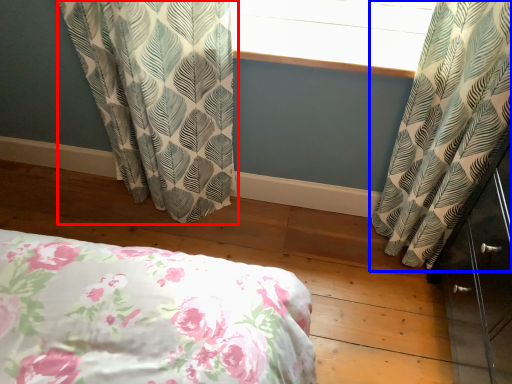
Question: Which of the following is the farthest to the observer, curtain (highlighted by a red box) or curtain (highlighted by a blue box)?

Choices:
 (A) curtain
 (B) curtain

Answer: (A)